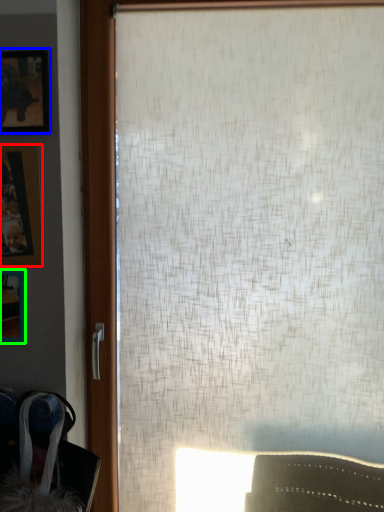
Question: Which is nearer to the picture frame (highlighted by a red box)? picture frame (highlighted by a blue box) or picture frame (highlighted by a green box).

Choices:
 (A) picture frame
 (B) picture frame

Answer: (B)